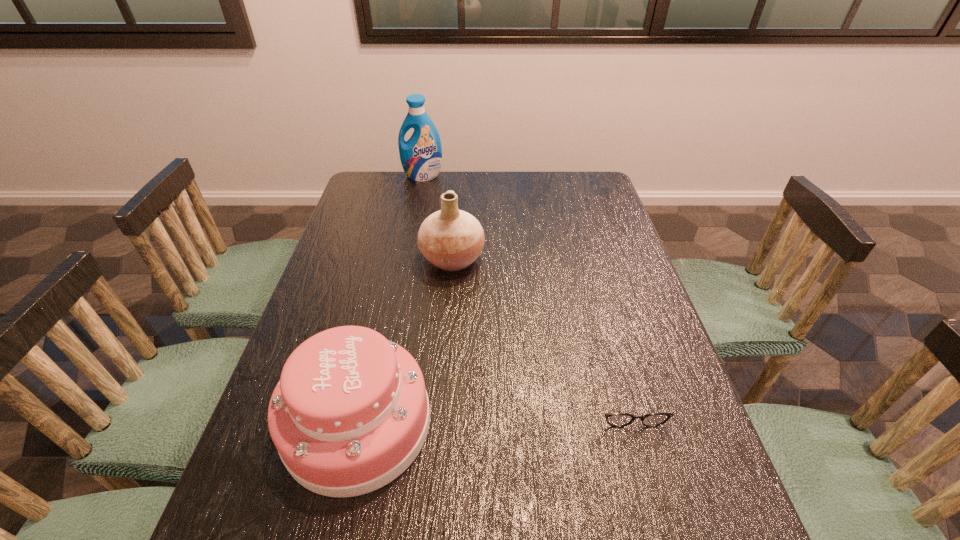
Where is `object at the far edge`? The height and width of the screenshot is (540, 960). object at the far edge is located at coordinates tap(421, 156).

The height and width of the screenshot is (540, 960). Find the location of `detergent present at the left edge`. detergent present at the left edge is located at coordinates (421, 156).

Locate an element on the screen. The image size is (960, 540). cake positioned at the left edge is located at coordinates (350, 413).

I want to click on object present at the right edge, so click(x=613, y=419).

Where is `object present at the far left corner`? object present at the far left corner is located at coordinates (421, 156).

This screenshot has height=540, width=960. I want to click on vacant space at the far edge of the desktop, so click(x=520, y=187).

This screenshot has height=540, width=960. In order to click on vacant space at the left edge of the desktop in this screenshot , I will do `click(384, 244)`.

This screenshot has height=540, width=960. Identify the location of free location at the right edge. (598, 217).

The width and height of the screenshot is (960, 540). Identify the location of vacant space at the far left corner of the desktop. (355, 198).

In the image, there is a desktop. What are the coordinates of `blank space at the far right corner` in the screenshot? It's located at (603, 201).